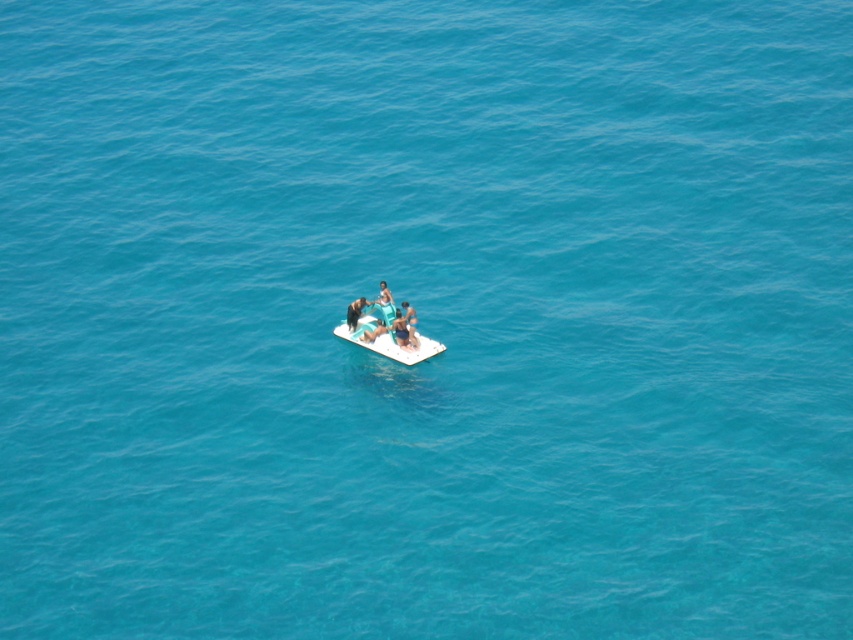
You are planning to take a photo of the smooth blue shorts at center and the blue fabric person at center from above. Which one will appear larger in the photo?

The smooth blue shorts at center will appear larger in the photo because it is taller than the blue fabric person at center.

From the picture: You are on a floating platform in the middle of a vast turquoise blue water. You see a smooth blue shorts at center and a blue fabric person at center. Which object is closer to you?

The smooth blue shorts at center is closer to the viewer than the blue fabric person at center.

You are a swimmer floating in the turquoise blue water near the white plastic raft at center and the blue fabric person at center. You want to climb onto the raft to rest. Which object should you approach to get onto the raft safely?

You should approach the white plastic raft at center because it is much taller than the blue fabric person at center, making it easier to climb onto from the water.